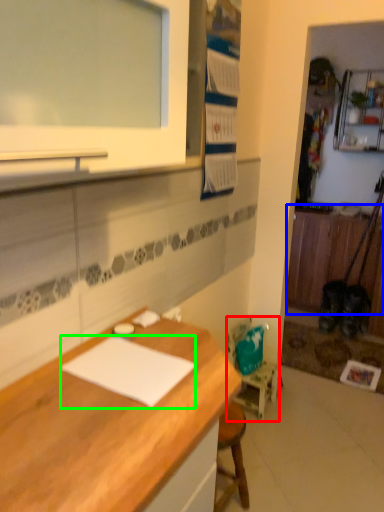
Question: Based on their relative distances, which object is nearer to chair (highlighted by a red box)? Choose from cabinetry (highlighted by a blue box) and notepad (highlighted by a green box).

Choices:
 (A) cabinetry
 (B) notepad

Answer: (B)